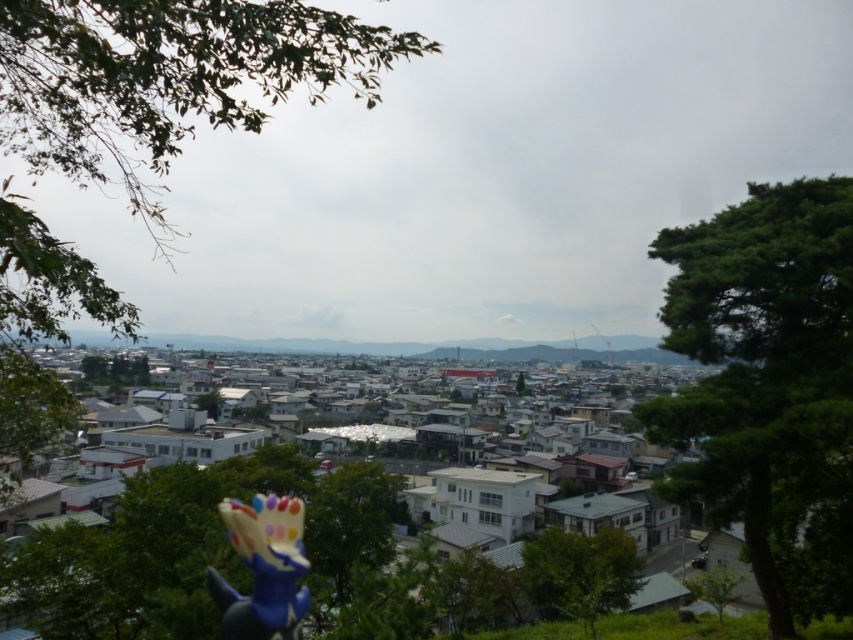
Question: Is green leafy tree at lower right smaller than green leafy tree at center?

Choices:
 (A) yes
 (B) no

Answer: (A)

Question: Is green leafy tree at right below green leafy tree at center?

Choices:
 (A) yes
 (B) no

Answer: (B)

Question: Estimate the real-world distances between objects in this image. Which object is closer to the green leafy tree at center?

Choices:
 (A) green leafy tree at lower right
 (B) blue rubber glove at lower center
 (C) green leafy tree at lower center
 (D) green leafy tree at right

Answer: (C)

Question: Which of the following is the closest to the observer?

Choices:
 (A) green leafy tree at center
 (B) blue rubber glove at lower center
 (C) green leafy tree at lower right

Answer: (B)

Question: Does green leafy tree at lower center have a greater width compared to green leafy tree at lower right?

Choices:
 (A) no
 (B) yes

Answer: (A)

Question: Estimate the real-world distances between objects in this image. Which object is closer to the green leafy tree at lower right?

Choices:
 (A) green leafy tree at center
 (B) green leafy tree at upper left
 (C) blue rubber glove at lower center
 (D) green leafy tree at right

Answer: (D)